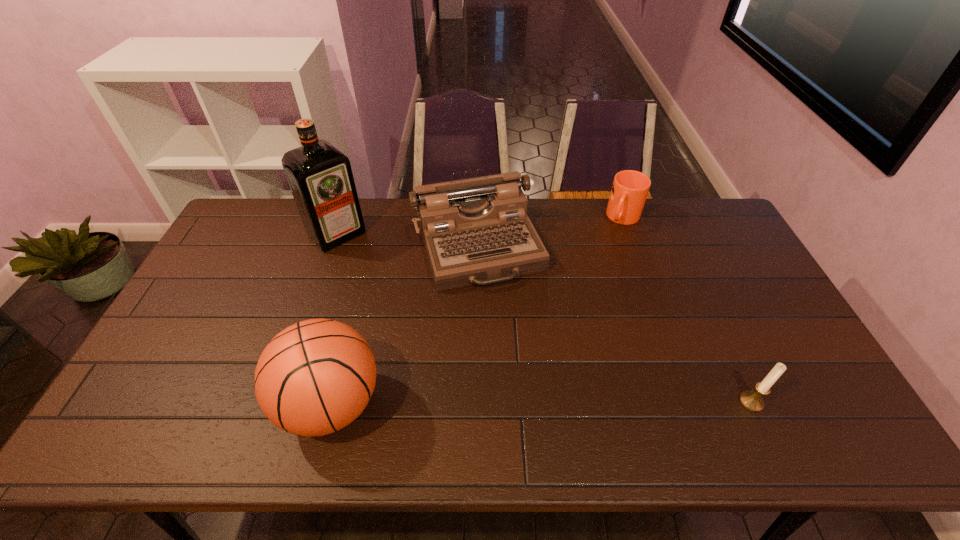
Find the location of `basketball`. basketball is located at coordinates (315, 377).

Where is `candle holder`? candle holder is located at coordinates (751, 400).

The height and width of the screenshot is (540, 960). In order to click on the third tallest object in this screenshot , I will do `click(478, 228)`.

Where is `the third object from right to left`? This screenshot has width=960, height=540. the third object from right to left is located at coordinates (478, 228).

Locate an element on the screen. the tallest object is located at coordinates (320, 177).

The image size is (960, 540). Find the location of `the second object from right to left`. the second object from right to left is located at coordinates (630, 188).

Identify the location of vacant space located on the right of the fourth shortest object. This screenshot has height=540, width=960. (453, 404).

At what (x,y) coordinates should I click in order to perform the action: click on vacant space situated 0.320m on the back of the rightmost object. Please return your answer as a coordinate pair (x, y). Image resolution: width=960 pixels, height=540 pixels. Looking at the image, I should click on (702, 297).

This screenshot has height=540, width=960. I want to click on vacant space located 0.080m on the keyboard of the third object from right to left, so 504,310.

The height and width of the screenshot is (540, 960). I want to click on free space located on the keyboard of the third object from right to left, so [515, 336].